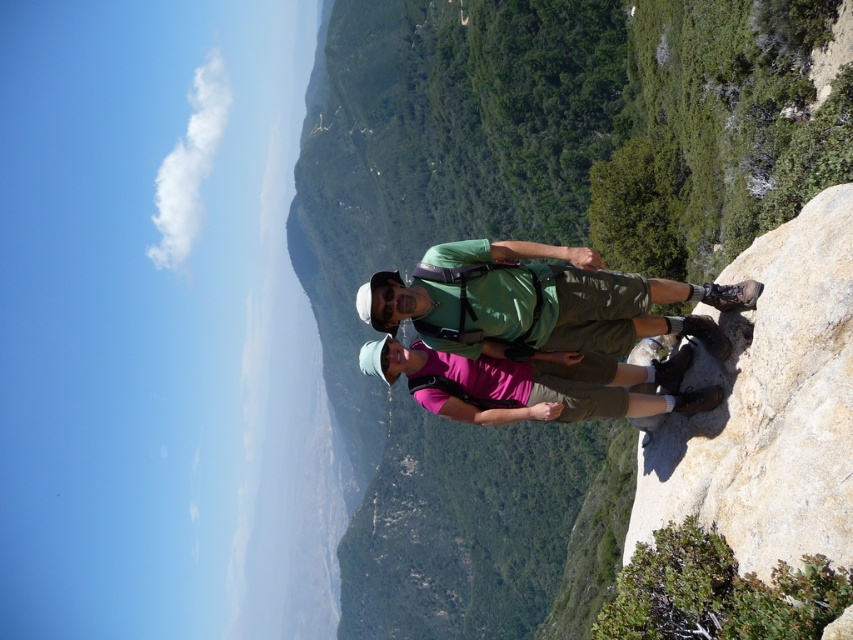
Question: Which point is closer to the camera?

Choices:
 (A) (631, 404)
 (B) (740, 288)

Answer: (B)

Question: Does green leafy mountain at center lie in front of green matte shirt at center?

Choices:
 (A) yes
 (B) no

Answer: (B)

Question: Does green leafy mountain at center appear under green matte shirt at center?

Choices:
 (A) yes
 (B) no

Answer: (B)

Question: Does green leafy mountain at center have a smaller size compared to pink fabric shirt at center?

Choices:
 (A) no
 (B) yes

Answer: (A)

Question: Among these objects, which one is nearest to the camera?

Choices:
 (A) green leafy mountain at center
 (B) green matte shirt at center

Answer: (B)

Question: Which is farther from the green leafy mountain at center?

Choices:
 (A) green matte shirt at center
 (B) pink fabric shirt at center

Answer: (B)